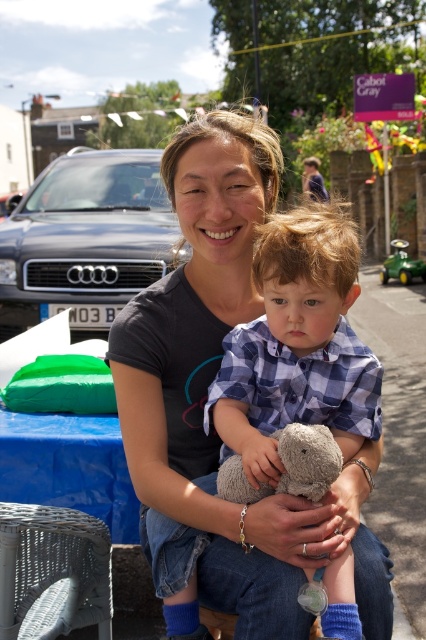
You are organizing a childrens party and need to decide which item to place in a gift bag. The blue checkered shirt at center and the green plastic toy car at right are options. Which item is smaller and better suited for a gift bag?

The blue checkered shirt at center has a smaller size compared to the green plastic toy car at right, so it is better suited for a gift bag.

What is the relationship between the height of the blue checkered shirt at center and the green plastic toy car at right?

The blue checkered shirt at center is shorter than the green plastic toy car at right.

You are a photographer trying to capture the child in the blue checkered shirt at center holding the fuzzy gray teddy bear at center. Can you tell me if the teddy bear is under or above the shirt?

The blue checkered shirt at center is positioned over fuzzy gray teddy bear at center, so the teddy bear is under the shirt.